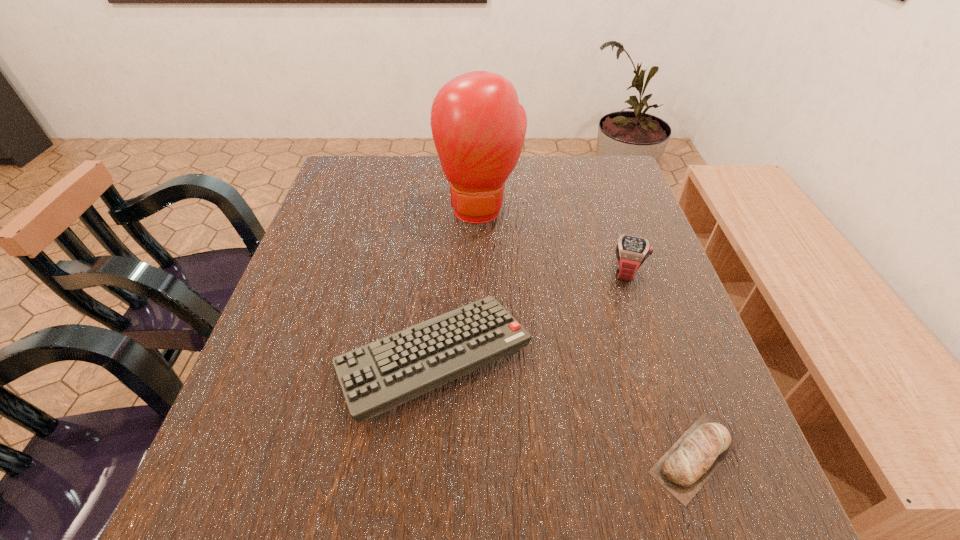
This screenshot has height=540, width=960. In order to click on free spot between the second farthest object and the farthest object in this screenshot , I will do `click(554, 240)`.

What are the coordinates of `free point between the boxing glove and the third tallest object` in the screenshot? It's located at (457, 283).

Locate which object is the closest to the watch. Please provide its 2D coordinates. Your answer should be formatted as a tuple, i.e. [(x, y)], where the tuple contains the x and y coordinates of a point satisfying the conditions above.

[(478, 126)]

Find the location of a particular element. This screenshot has width=960, height=540. the second closest object to the tallest object is located at coordinates (376, 377).

Where is `free location that satisfies the following two spatial constraints: 1. on the back side of the computer keyboard; 2. on the left side of the third nearest object`? The width and height of the screenshot is (960, 540). free location that satisfies the following two spatial constraints: 1. on the back side of the computer keyboard; 2. on the left side of the third nearest object is located at coordinates (441, 272).

This screenshot has height=540, width=960. Find the location of `vacant point that satisfies the following two spatial constraints: 1. on the back side of the third tallest object; 2. on the left side of the second farthest object`. vacant point that satisfies the following two spatial constraints: 1. on the back side of the third tallest object; 2. on the left side of the second farthest object is located at coordinates (441, 272).

Locate an element on the screen. This screenshot has height=540, width=960. free location that satisfies the following two spatial constraints: 1. on the back side of the third shortest object; 2. on the left side of the computer keyboard is located at coordinates (441, 272).

The image size is (960, 540). I want to click on vacant point that satisfies the following two spatial constraints: 1. on the striking surface of the tallest object; 2. on the right side of the shortest object, so click(481, 456).

Locate an element on the screen. free space in the image that satisfies the following two spatial constraints: 1. on the striking surface of the boxing glove; 2. on the right side of the shortest object is located at coordinates (481, 456).

Locate an element on the screen. Image resolution: width=960 pixels, height=540 pixels. vacant space that satisfies the following two spatial constraints: 1. on the front side of the third nearest object; 2. on the left side of the pita bread is located at coordinates (688, 456).